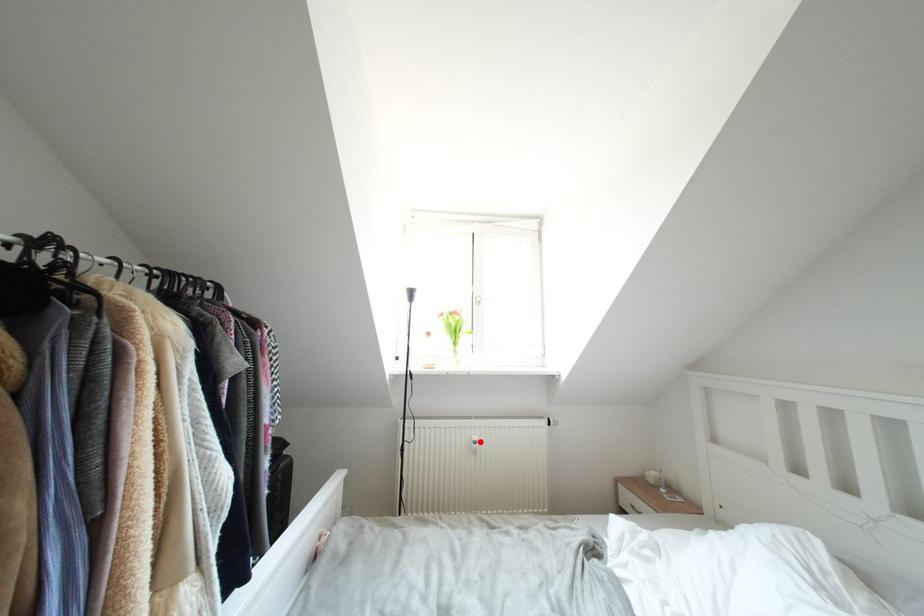
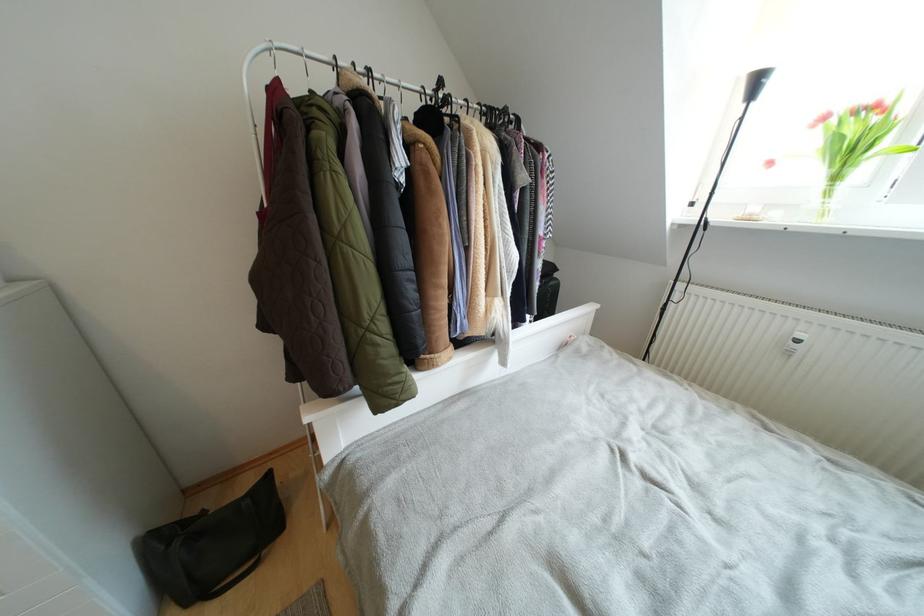
Question: I am providing you with two images of the same scene from different viewpoints. In image1, a red point is highlighted. Considering the same 3D point in image2, which of the following is correct?

Choices:
 (A) It is closer
 (B) It is farther

Answer: (A)